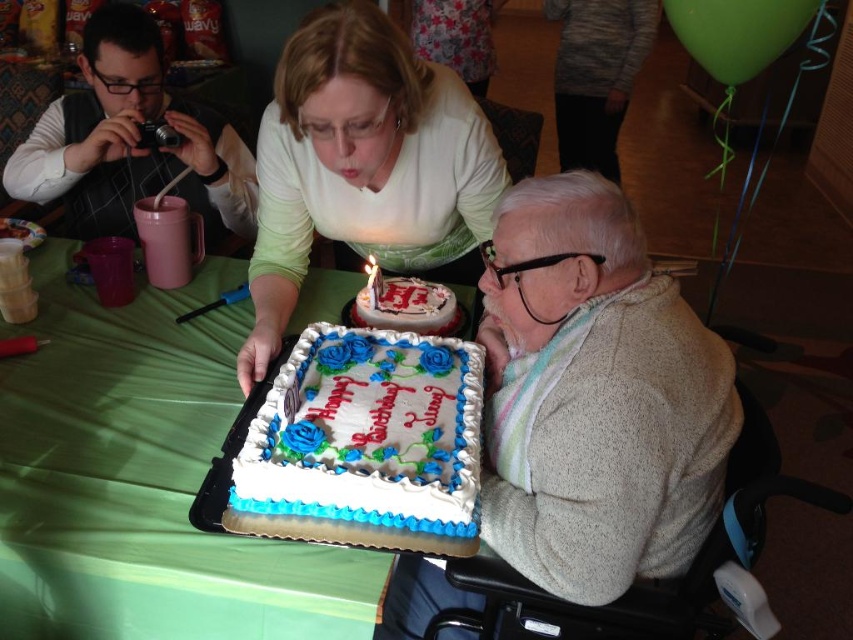
Measure the distance between point (206, 614) and camera.

37.10 inches

What do you see at coordinates (144, 481) in the screenshot? The height and width of the screenshot is (640, 853). I see `green fabric table at lower left` at bounding box center [144, 481].

Which is behind, point (212, 355) or point (448, 314)?

Positioned behind is point (212, 355).

Where is `green fabric table at lower left`? green fabric table at lower left is located at coordinates click(144, 481).

Does matte black camera at upper left appear on the right side of white frosted cake with blue and green decorations at center?

No, matte black camera at upper left is not to the right of white frosted cake with blue and green decorations at center.

Is point (80, 58) positioned behind point (392, 280)?

That is True.

Locate an element on the screen. matte black camera at upper left is located at coordinates (123, 138).

Does white textured sweater at lower right come behind white paper birthday candle at center?

No, white textured sweater at lower right is closer to the viewer.

Which is above, white textured sweater at lower right or white paper birthday candle at center?

white paper birthday candle at center is higher up.

Does point (512, 566) come behind point (379, 278)?

No, it is not.

Where is `white textured sweater at lower right`? The width and height of the screenshot is (853, 640). white textured sweater at lower right is located at coordinates pyautogui.click(x=595, y=397).